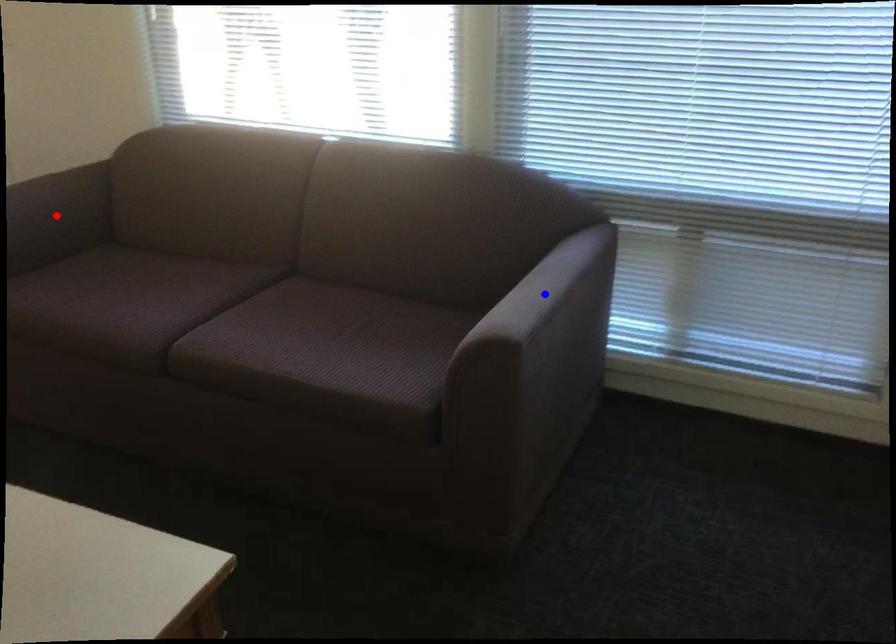
Question: Which of the two points in the image is closer to the camera?

Choices:
 (A) Blue point is closer.
 (B) Red point is closer.

Answer: (A)